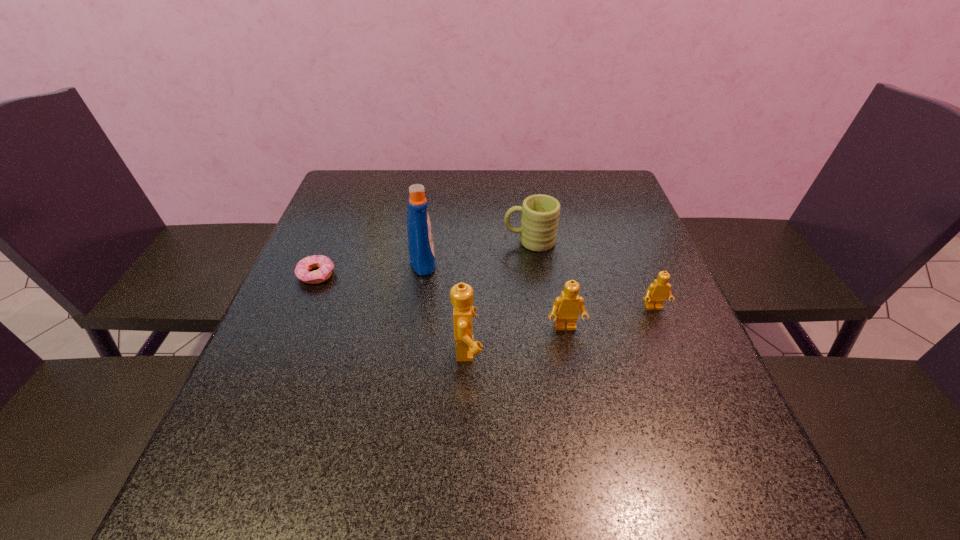
Find the location of `vacant space located on the face of the tallest Lego`. vacant space located on the face of the tallest Lego is located at coordinates (612, 349).

Locate an element on the screen. This screenshot has width=960, height=540. free space located 0.250m on the face of the second Lego from left to right is located at coordinates (588, 451).

At what (x,y) coordinates should I click in order to perform the action: click on free location located on the face of the fifth tallest object. Please return your answer as a coordinate pair (x, y). Looking at the image, I should click on (688, 392).

You are a GUI agent. You are given a task and a screenshot of the screen. Output one action in this format:
    pyautogui.click(x=<x>, y=<y>)
    Task: Click on the free space located on the label of the tallest object
    This screenshot has height=540, width=960.
    Given the screenshot: What is the action you would take?
    pyautogui.click(x=537, y=261)

The width and height of the screenshot is (960, 540). What are the coordinates of `vacant area situated 0.370m on the side of the mug with the handle` in the screenshot? It's located at (362, 241).

This screenshot has width=960, height=540. What are the coordinates of `vacant point located on the side of the mug with the handle` in the screenshot? It's located at (396, 241).

The height and width of the screenshot is (540, 960). In order to click on vacant space located 0.060m on the side of the mug with the handle in this screenshot , I will do `click(480, 241)`.

The height and width of the screenshot is (540, 960). I want to click on free space located on the front of the shortest object, so click(258, 416).

Image resolution: width=960 pixels, height=540 pixels. In order to click on object that is positioned at the left edge in this screenshot , I will do `click(325, 265)`.

The image size is (960, 540). What are the coordinates of `object that is at the right edge` in the screenshot? It's located at (657, 292).